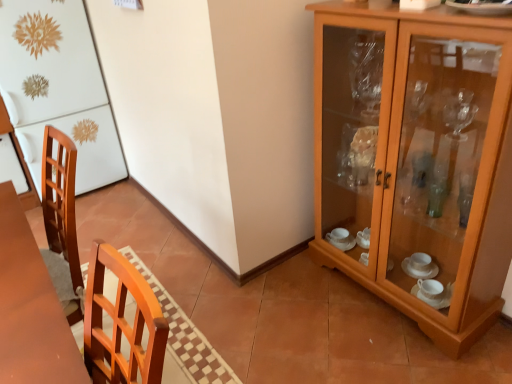
This screenshot has height=384, width=512. Find the location of `white glossy refrigerator at left`. white glossy refrigerator at left is located at coordinates (58, 87).

Describe the element at coordinates (58, 87) in the screenshot. I see `white glossy refrigerator at left` at that location.

Image resolution: width=512 pixels, height=384 pixels. Describe the element at coordinates (422, 161) in the screenshot. I see `wooden cabinet at right` at that location.

Based on the photo, what is the approximate width of wooden cabinet at right?

wooden cabinet at right is 13.37 inches in width.

At what (x,y) coordinates should I click in order to perform the action: click on wooden cabinet at right. Please return your answer as a coordinate pair (x, y). The width and height of the screenshot is (512, 384). Looking at the image, I should click on (422, 161).

The image size is (512, 384). I want to click on white glossy refrigerator at left, so click(58, 87).

Which is more to the right, white glossy refrigerator at left or wooden cabinet at right?

wooden cabinet at right.

Is white glossy refrigerator at left closer to camera compared to wooden cabinet at right?

No, white glossy refrigerator at left is further to the viewer.

Considering the points (39, 97) and (446, 278), which point is behind, point (39, 97) or point (446, 278)?

The point (39, 97) is behind.

From the image's perspective, who appears lower, white glossy refrigerator at left or wooden cabinet at right?

wooden cabinet at right.

From a real-world perspective, is white glossy refrigerator at left physically above wooden cabinet at right?

Correct, in the physical world, white glossy refrigerator at left is higher than wooden cabinet at right.

Which of these two, white glossy refrigerator at left or wooden cabinet at right, is wider?

Wider between the two is white glossy refrigerator at left.

Consider the image. Does white glossy refrigerator at left have a greater height compared to wooden cabinet at right?

Yes.

Between white glossy refrigerator at left and wooden cabinet at right, which one has larger size?

With larger size is white glossy refrigerator at left.

Does white glossy refrigerator at left contain wooden cabinet at right?

No, wooden cabinet at right is not inside white glossy refrigerator at left.

Would you say white glossy refrigerator at left is a long distance from wooden cabinet at right?

Yes.

Is white glossy refrigerator at left oriented away from wooden cabinet at right?

white glossy refrigerator at left does not have its back to wooden cabinet at right.

How many degrees apart are the facing directions of white glossy refrigerator at left and wooden cabinet at right?

The angular difference between white glossy refrigerator at left and wooden cabinet at right is 90 degrees.

Measure the distance between white glossy refrigerator at left and wooden cabinet at right.

1.92 meters.

In the image, there is a white glossy refrigerator at left. Where is `cabinetry below it (from the image's perspective)`? cabinetry below it (from the image's perspective) is located at coordinates (422, 161).

Is wooden cabinet at right to the left of white glossy refrigerator at left from the viewer's perspective?

No.

Which object is closer to the camera, wooden cabinet at right or white glossy refrigerator at left?

wooden cabinet at right is more forward.

Which is closer, [449,220] or [9,105]?

The point [449,220] is more forward.

From the image's perspective, is wooden cabinet at right over white glossy refrigerator at left?

Actually, wooden cabinet at right appears below white glossy refrigerator at left in the image.

From a real-world perspective, is wooden cabinet at right located higher than white glossy refrigerator at left?

No, from a real-world perspective, wooden cabinet at right is not over white glossy refrigerator at left

In terms of width, does wooden cabinet at right look wider or thinner when compared to white glossy refrigerator at left?

Clearly, wooden cabinet at right has less width compared to white glossy refrigerator at left.

Which of these two, wooden cabinet at right or white glossy refrigerator at left, stands taller?

white glossy refrigerator at left.

Which of these two, wooden cabinet at right or white glossy refrigerator at left, is bigger?

With larger size is white glossy refrigerator at left.

Is wooden cabinet at right not within white glossy refrigerator at left?

Yes, wooden cabinet at right is not within white glossy refrigerator at left.

Is there a large distance between wooden cabinet at right and white glossy refrigerator at left?

Yes, wooden cabinet at right and white glossy refrigerator at left are quite far apart.

Is wooden cabinet at right turned away from white glossy refrigerator at left?

No, white glossy refrigerator at left is not at the back of wooden cabinet at right.

At what (x,y) coordinates should I click in order to perform the action: click on fridge behind the wooden cabinet at right. Please return your answer as a coordinate pair (x, y). Looking at the image, I should click on (58, 87).

Where is `cabinetry that is on the right side of white glossy refrigerator at left`? This screenshot has width=512, height=384. cabinetry that is on the right side of white glossy refrigerator at left is located at coordinates (422, 161).

At what (x,y) coordinates should I click in order to perform the action: click on fridge lying on the left of wooden cabinet at right. Please return your answer as a coordinate pair (x, y). Looking at the image, I should click on (58, 87).